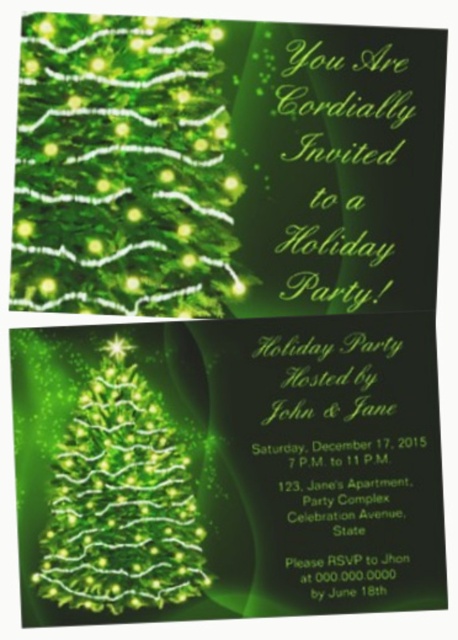
You are designing a holiday card and want to place a Christmas tree image. The invitation already has two Christmas trees described as green matte christmas tree at center and green glittering christmas tree at center. According to the description, which tree is taller?

The green matte christmas tree at center is much taller than the green glittering christmas tree at center.